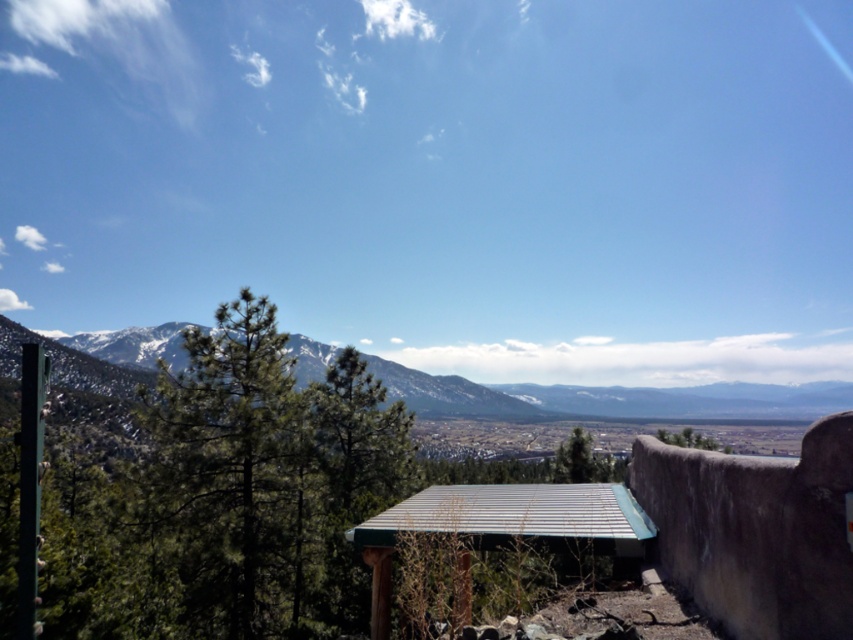
Consider the image. Who is shorter, green textured pine tree at center or green matte tree at center?

With less height is green textured pine tree at center.

Which is more to the left, green textured pine tree at center or green matte tree at center?

green textured pine tree at center

At what (x,y) coordinates should I click in order to perform the action: click on green textured pine tree at center. Please return your answer as a coordinate pair (x, y). Looking at the image, I should click on (270, 480).